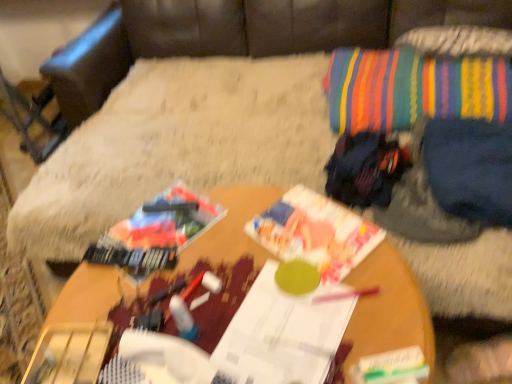
Question: From a real-world perspective, relative to wooden table at center, is multicolored fabric bean bag chair at upper right vertically above or below?

Choices:
 (A) below
 (B) above

Answer: (B)

Question: Is multicolored fabric bean bag chair at upper right taller or shorter than wooden table at center?

Choices:
 (A) tall
 (B) short

Answer: (A)

Question: Based on their relative distances, which object is farther from the striped fabric throw pillow at upper right?

Choices:
 (A) dark blue fabric at upper right
 (B) printed paper magazine at center, positioned as the 1th magazine in top-to-bottom order
 (C) wooden table at center
 (D) white paper magazine at center, arranged as the second magazine when viewed from the top
 (E) multicolored fabric bean bag chair at upper right

Answer: (D)

Question: Which object is positioned closest to the striped fabric throw pillow at upper right?

Choices:
 (A) printed paper magazine at center, positioned as the 1th magazine in top-to-bottom order
 (B) dark blue fabric at upper right
 (C) wooden table at center
 (D) white paper magazine at center, arranged as the second magazine when viewed from the top
 (E) multicolored fabric bean bag chair at upper right

Answer: (B)